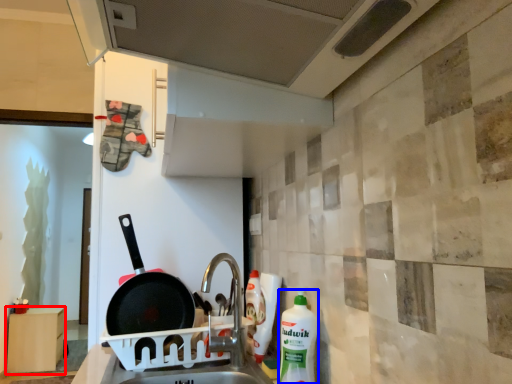
Question: Among these objects, which one is nearest to the camera, furniture (highlighted by a red box) or cleaning product (highlighted by a blue box)?

Choices:
 (A) furniture
 (B) cleaning product

Answer: (B)